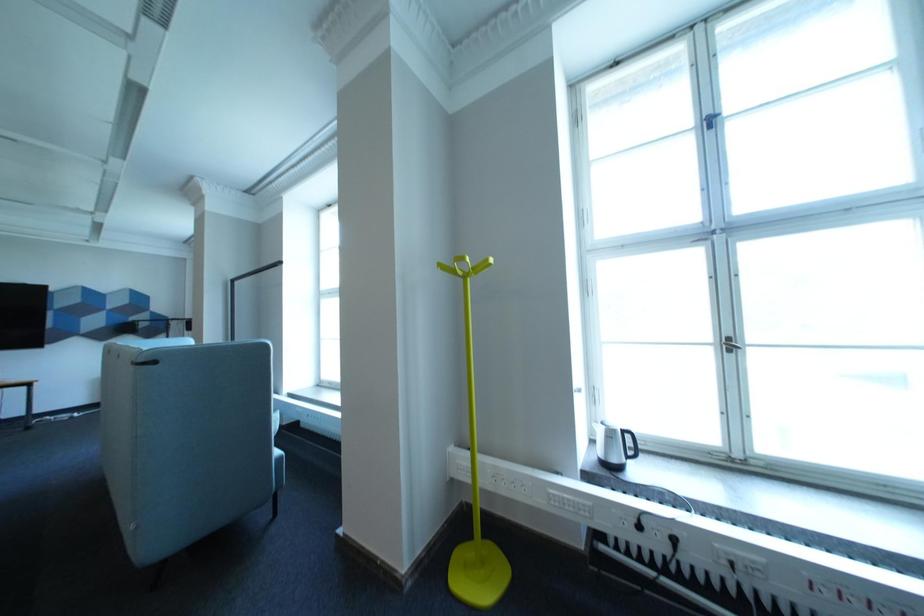
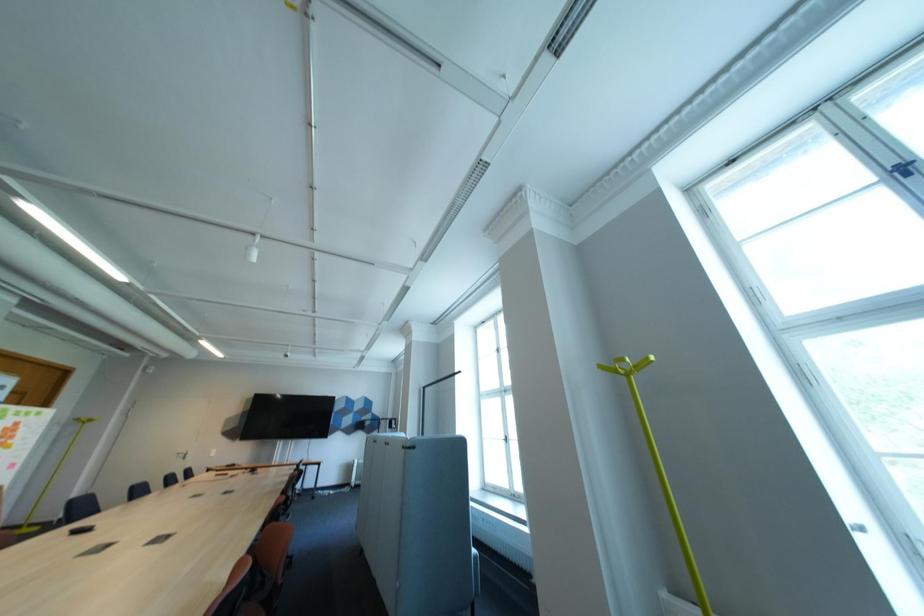
Based on the continuous images, in which direction is the camera rotating?

The rotation direction of the camera is left-up.